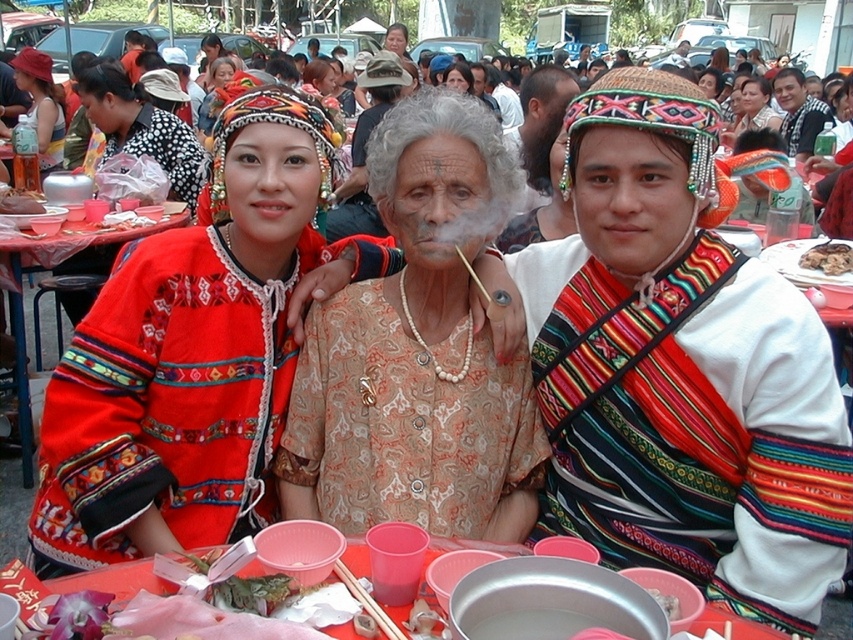
Question: Which point is closer to the camera taking this photo?

Choices:
 (A) pos(769,285)
 (B) pos(670,602)

Answer: (B)

Question: Which point is closer to the camera?

Choices:
 (A) (352, 324)
 (B) (293, 372)

Answer: (A)

Question: Can you confirm if matte beige blouse at center is positioned to the right of black woven shirt at upper center?

Choices:
 (A) no
 (B) yes

Answer: (A)

Question: Considering the relative positions of brown crispy bread at center and smooth white rice at center in the image provided, where is brown crispy bread at center located with respect to smooth white rice at center?

Choices:
 (A) left
 (B) right

Answer: (B)

Question: Can you confirm if red embroidered sweater at left is positioned above matte black dress at center?

Choices:
 (A) no
 (B) yes

Answer: (A)

Question: Among these objects, which one is nearest to the camera?

Choices:
 (A) smooth white rice at center
 (B) multicolored woven sash at right
 (C) brown crispy bread at center
 (D) red embroidered sweater at left

Answer: (A)